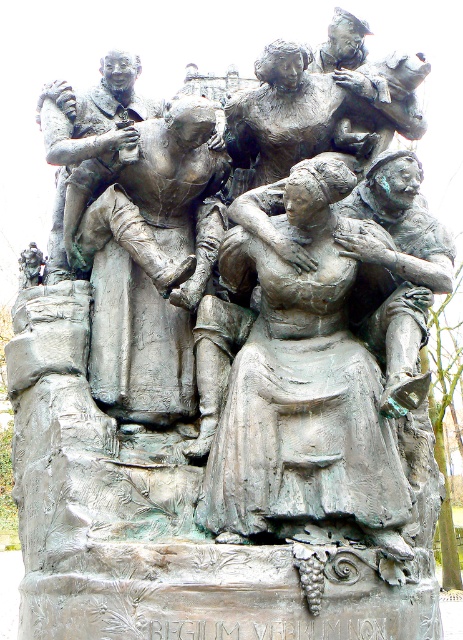
Question: Among these objects, which one is farthest from the camera?

Choices:
 (A) bronze statue of man at center
 (B) bronze statue of woman at center

Answer: (A)

Question: Does bronze statue of woman at center have a greater width compared to bronze statue of man at center?

Choices:
 (A) no
 (B) yes

Answer: (B)

Question: Does bronze statue of woman at center appear under bronze statue of man at center?

Choices:
 (A) no
 (B) yes

Answer: (B)

Question: In this image, where is bronze statue of woman at center located relative to bronze statue of man at center?

Choices:
 (A) left
 (B) right

Answer: (B)

Question: Among these points, which one is nearest to the camera?

Choices:
 (A) (70, 246)
 (B) (248, 460)

Answer: (B)